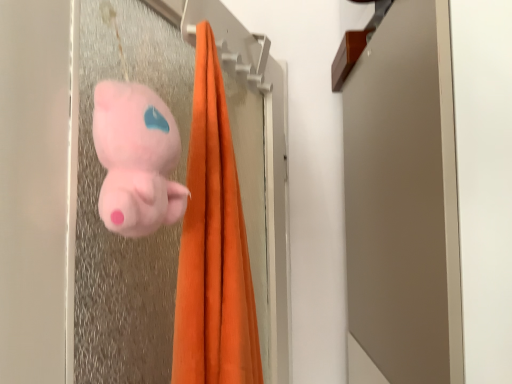
Image resolution: width=512 pixels, height=384 pixels. What do you see at coordinates (136, 159) in the screenshot?
I see `fluffy pink plush at center` at bounding box center [136, 159].

You are a GUI agent. You are given a task and a screenshot of the screen. Output one action in this format:
    pyautogui.click(x=<x>, y=<y>)
    Task: Click on the fluffy pink plush at center
    The image size is (512, 384).
    Given the screenshot: What is the action you would take?
    pyautogui.click(x=136, y=159)

Locate an element on the screen. Image resolution: width=512 pixels, height=384 pixels. matte plastic screen door at upper center is located at coordinates (x=97, y=209).

Measure the distance between matte plastic screen door at upper center and camera.

18.68 inches.

Image resolution: width=512 pixels, height=384 pixels. Describe the element at coordinates (97, 209) in the screenshot. I see `matte plastic screen door at upper center` at that location.

Find the location of a particular element. Image resolution: width=512 pixels, height=384 pixels. fluffy pink plush at center is located at coordinates (136, 159).

Which is more to the right, fluffy pink plush at center or matte plastic screen door at upper center?

Positioned to the right is matte plastic screen door at upper center.

Considering the relative positions of fluffy pink plush at center and matte plastic screen door at upper center in the image provided, is fluffy pink plush at center behind matte plastic screen door at upper center?

Yes, fluffy pink plush at center is further from the camera.

Which is nearer, (144, 154) or (106, 357)?

Clearly, point (144, 154) is closer to the camera than point (106, 357).

From the image's perspective, does fluffy pink plush at center appear lower than matte plastic screen door at upper center?

No, from the image's perspective, fluffy pink plush at center is not below matte plastic screen door at upper center.

From a real-world perspective, who is located lower, fluffy pink plush at center or matte plastic screen door at upper center?

matte plastic screen door at upper center is physically lower.

Considering the sizes of fluffy pink plush at center and matte plastic screen door at upper center in the image, is fluffy pink plush at center wider or thinner than matte plastic screen door at upper center?

fluffy pink plush at center is thinner than matte plastic screen door at upper center.

Who is taller, fluffy pink plush at center or matte plastic screen door at upper center?

Standing taller between the two is matte plastic screen door at upper center.

Does fluffy pink plush at center have a larger size compared to matte plastic screen door at upper center?

Incorrect, fluffy pink plush at center is not larger than matte plastic screen door at upper center.

Is fluffy pink plush at center not within matte plastic screen door at upper center?

No, most part of fluffy pink plush at center lies within matte plastic screen door at upper center.

Is fluffy pink plush at center placed right next to matte plastic screen door at upper center?

No, fluffy pink plush at center is not with matte plastic screen door at upper center.

Is fluffy pink plush at center oriented towards matte plastic screen door at upper center?

Yes, fluffy pink plush at center is aimed at matte plastic screen door at upper center.

The width and height of the screenshot is (512, 384). I want to click on toy that appears behind the matte plastic screen door at upper center, so click(x=136, y=159).

Can you confirm if matte plastic screen door at upper center is positioned to the left of fluffy pink plush at center?

No, matte plastic screen door at upper center is not to the left of fluffy pink plush at center.

Between matte plastic screen door at upper center and fluffy pink plush at center, which one is positioned behind?

fluffy pink plush at center is further away from the camera.

Does point (115, 8) appear closer or farther from the camera than point (135, 113)?

Point (115, 8) is farther from the camera than point (135, 113).

From the image's perspective, which one is positioned higher, matte plastic screen door at upper center or fluffy pink plush at center?

fluffy pink plush at center.

From a real-world perspective, is matte plastic screen door at upper center over fluffy pink plush at center?

No.

Which of these two, matte plastic screen door at upper center or fluffy pink plush at center, is wider?

matte plastic screen door at upper center.

Is matte plastic screen door at upper center shorter than fluffy pink plush at center?

Incorrect, the height of matte plastic screen door at upper center does not fall short of that of fluffy pink plush at center.

Can you confirm if matte plastic screen door at upper center is bigger than fluffy pink plush at center?

Indeed, matte plastic screen door at upper center has a larger size compared to fluffy pink plush at center.

Does matte plastic screen door at upper center contain fluffy pink plush at center?

Yes, fluffy pink plush at center is inside matte plastic screen door at upper center.

Is matte plastic screen door at upper center in contact with fluffy pink plush at center?

matte plastic screen door at upper center and fluffy pink plush at center are clearly separated.

Is matte plastic screen door at upper center aimed at fluffy pink plush at center?

Yes, matte plastic screen door at upper center is turned towards fluffy pink plush at center.

I want to click on toy that is above the matte plastic screen door at upper center (from the image's perspective), so click(x=136, y=159).

This screenshot has width=512, height=384. Find the location of `toy above the matte plastic screen door at upper center (from the image's perspective)`. toy above the matte plastic screen door at upper center (from the image's perspective) is located at coordinates (136, 159).

Find the location of a particular element. Image resolution: width=512 pixels, height=384 pixels. toy above the matte plastic screen door at upper center (from a real-world perspective) is located at coordinates (136, 159).